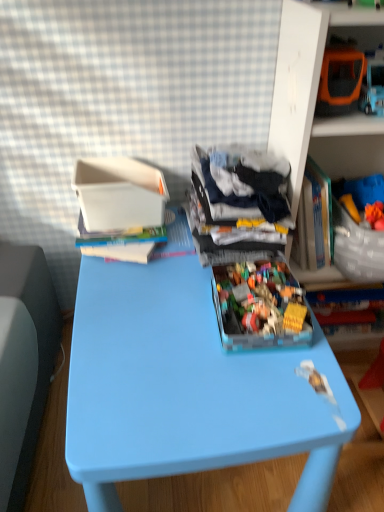
Where is `vacant area situated to the left side of translucent plastic container at center`? Image resolution: width=384 pixels, height=512 pixels. vacant area situated to the left side of translucent plastic container at center is located at coordinates (153, 321).